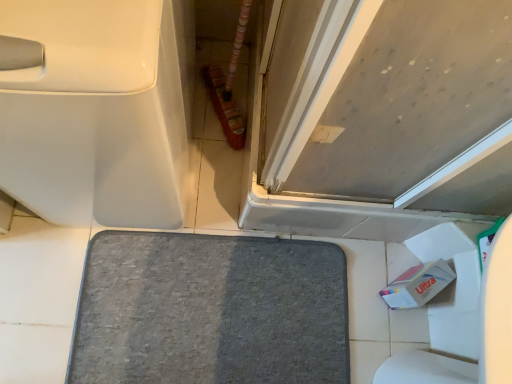
Question: Is gray soft carpet at center surrounding matte gray door at upper right?

Choices:
 (A) yes
 (B) no

Answer: (B)

Question: Can you confirm if gray soft carpet at center is taller than matte gray door at upper right?

Choices:
 (A) yes
 (B) no

Answer: (B)

Question: Can you confirm if gray soft carpet at center is shorter than matte gray door at upper right?

Choices:
 (A) no
 (B) yes

Answer: (B)

Question: From a real-world perspective, is gray soft carpet at center positioned over matte gray door at upper right based on gravity?

Choices:
 (A) yes
 (B) no

Answer: (B)

Question: Is gray soft carpet at center closer to camera compared to matte gray door at upper right?

Choices:
 (A) yes
 (B) no

Answer: (B)

Question: From a real-world perspective, is gray soft carpet at center physically below matte gray door at upper right?

Choices:
 (A) yes
 (B) no

Answer: (A)

Question: Is gray soft carpet at center taller than white glossy toilet at left?

Choices:
 (A) no
 (B) yes

Answer: (A)

Question: Can you confirm if gray soft carpet at center is wider than white glossy toilet at left?

Choices:
 (A) yes
 (B) no

Answer: (B)

Question: Considering the relative sizes of gray soft carpet at center and white glossy toilet at left in the image provided, is gray soft carpet at center thinner than white glossy toilet at left?

Choices:
 (A) yes
 (B) no

Answer: (A)

Question: From a real-world perspective, is gray soft carpet at center physically above white glossy toilet at left?

Choices:
 (A) yes
 (B) no

Answer: (B)

Question: Considering the relative sizes of gray soft carpet at center and white glossy toilet at left in the image provided, is gray soft carpet at center shorter than white glossy toilet at left?

Choices:
 (A) no
 (B) yes

Answer: (B)

Question: Does gray soft carpet at center appear on the right side of white glossy toilet at left?

Choices:
 (A) no
 (B) yes

Answer: (B)

Question: Can you see white glossy toilet at left touching gray soft carpet at center?

Choices:
 (A) yes
 (B) no

Answer: (B)